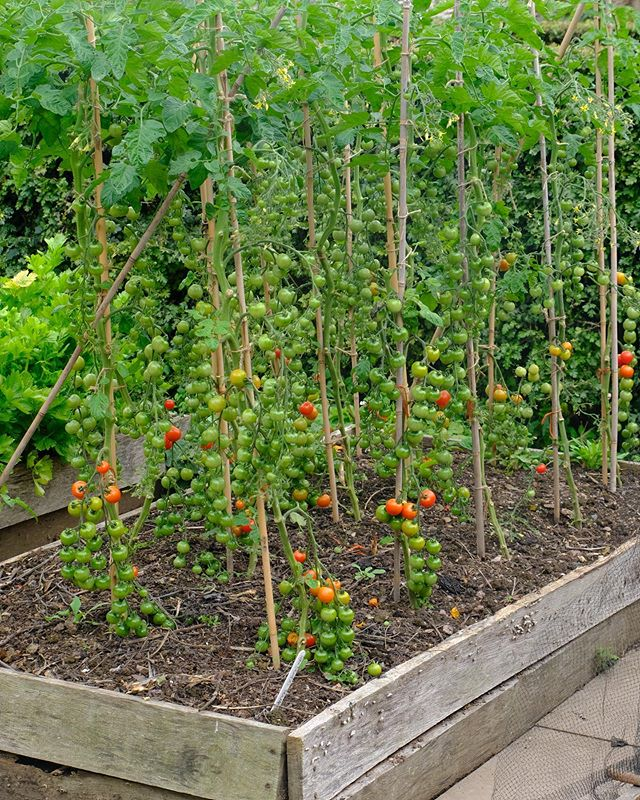
Where is `wooden boards`? The height and width of the screenshot is (800, 640). wooden boards is located at coordinates (413, 696), (427, 752), (187, 765), (102, 786), (52, 544), (51, 476).